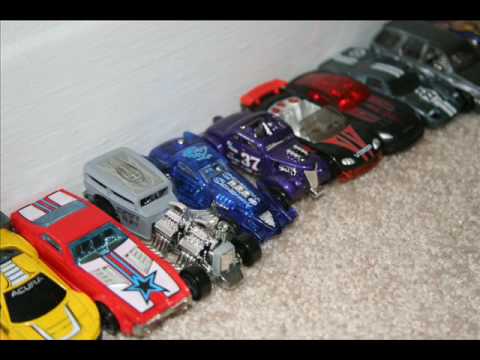
The height and width of the screenshot is (360, 480). I want to click on tan carpet, so click(363, 268).